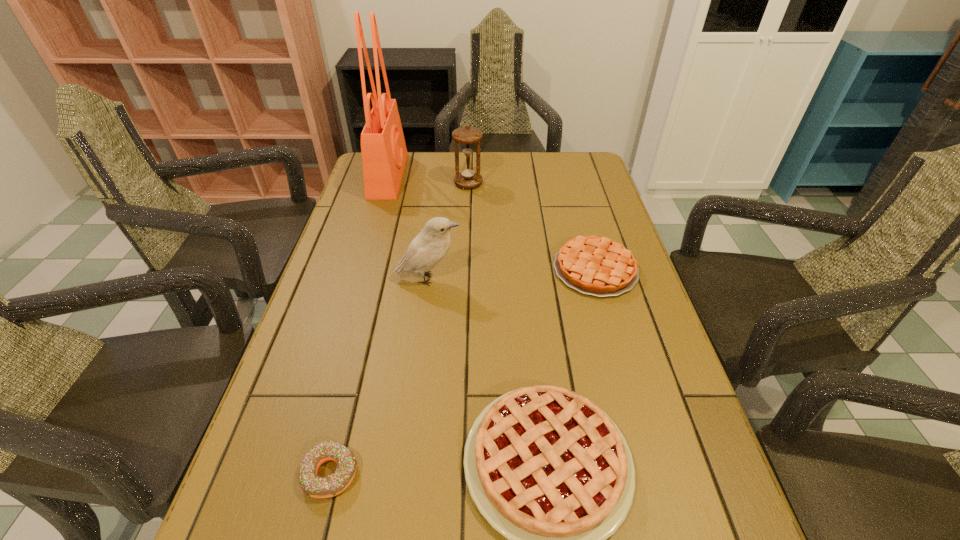
Locate an element on the screen. This screenshot has width=960, height=540. vacant space that satisfies the following two spatial constraints: 1. on the back side of the doughnut; 2. on the left side of the shorter pie is located at coordinates (380, 269).

This screenshot has width=960, height=540. In order to click on free space that satisfies the following two spatial constraints: 1. on the logo side of the tallest object; 2. on the right side of the doughnut in this screenshot , I will do `click(300, 473)`.